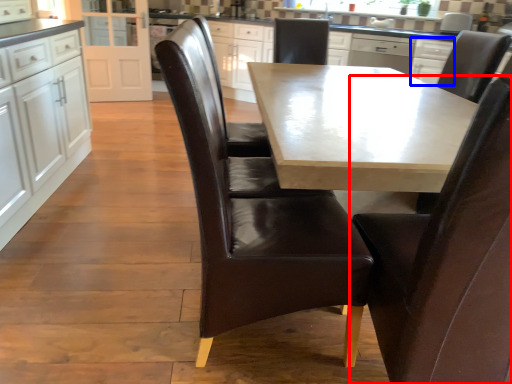
Question: Which object is further to the camera taking this photo, chair (highlighted by a red box) or cabinetry (highlighted by a blue box)?

Choices:
 (A) chair
 (B) cabinetry

Answer: (B)